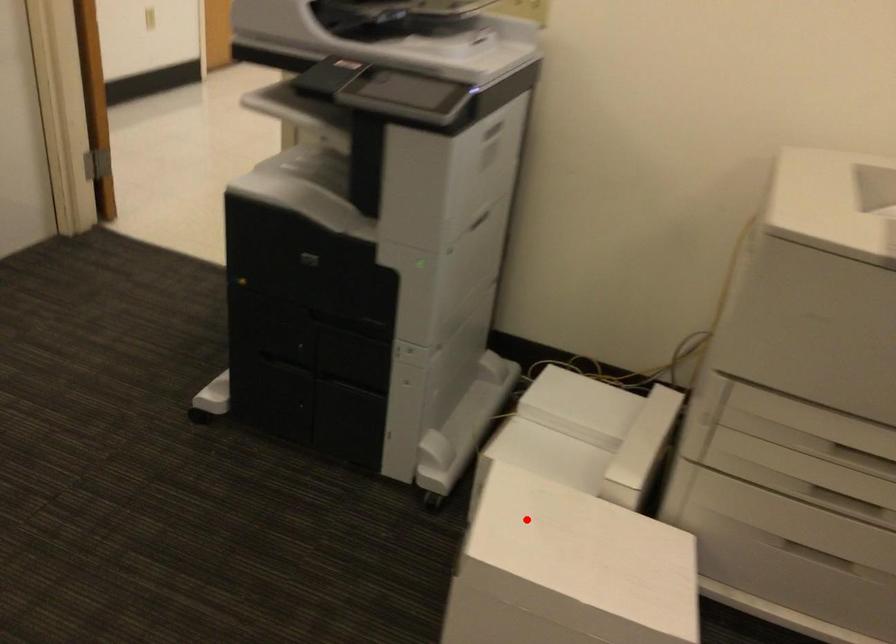
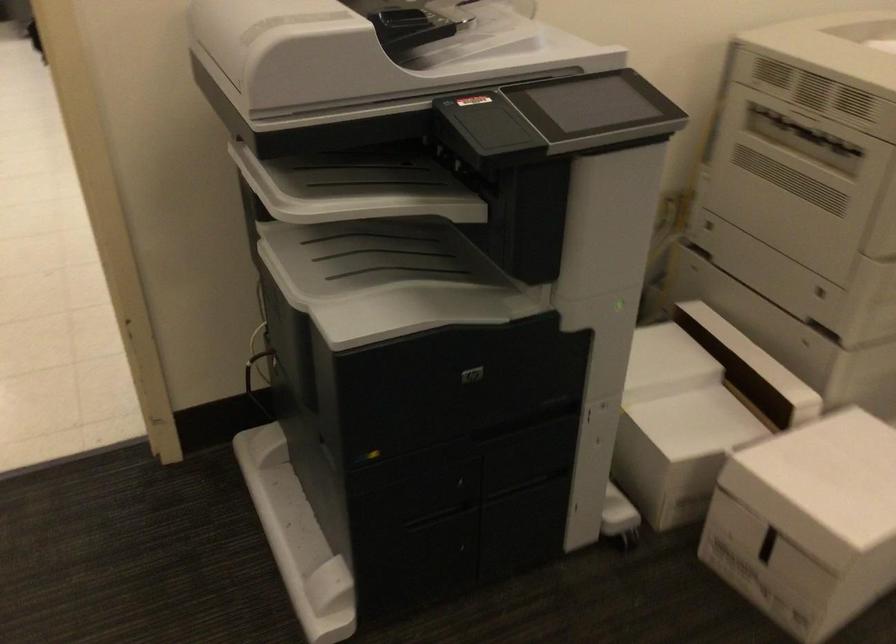
Find the pixel in the second image that matches the highlighted location in the first image.

(822, 484)